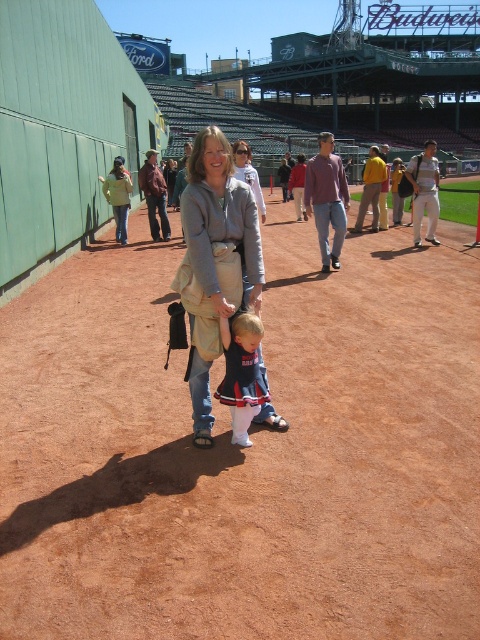
You are a photographer at the baseball stadium and want to capture both the matte gray hoodie at center and the light brown leather jacket at center in a single photo. Your camera has a maximum focus range of 7 meters. Can you fit both items in the photo without moving your position?

The matte gray hoodie at center and the light brown leather jacket at center are 7.51 meters apart. Since the distance between them exceeds the camera maximum focus range of 7 meters, you cannot fit both items in the photo without moving your position.

You are a spectator at the baseball stadium and want to locate your belongings. You remember you placed a matte gray hoodie at center and a light brown leather jacket at center. Which item is closer to the ground?

The matte gray hoodie at center is located below the light brown leather jacket at center, so it is closer to the ground.

You are standing at the center of the baseball stadium and see the light brown leather jacket at center. If you walk straight ahead, will you step on the jacket?

The light brown leather jacket at center is located at point (326, 198), so if you walk straight ahead from the center, you would step on the jacket since it is directly in front of you.